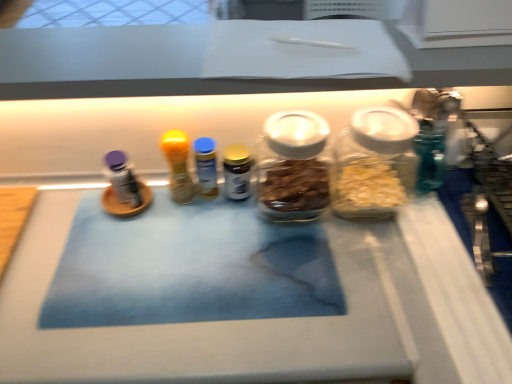
Identify the location of unoccupied area in front of transparent glass jar at center, which appears as the 2th bottle when viewed from the right. (328, 314).